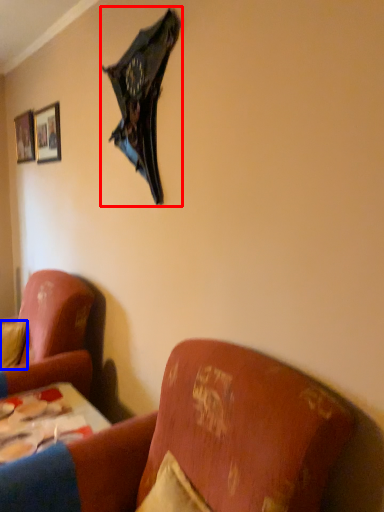
Question: Which of the following is the closest to the observer, umbrella (highlighted by a red box) or pillow (highlighted by a blue box)?

Choices:
 (A) umbrella
 (B) pillow

Answer: (A)